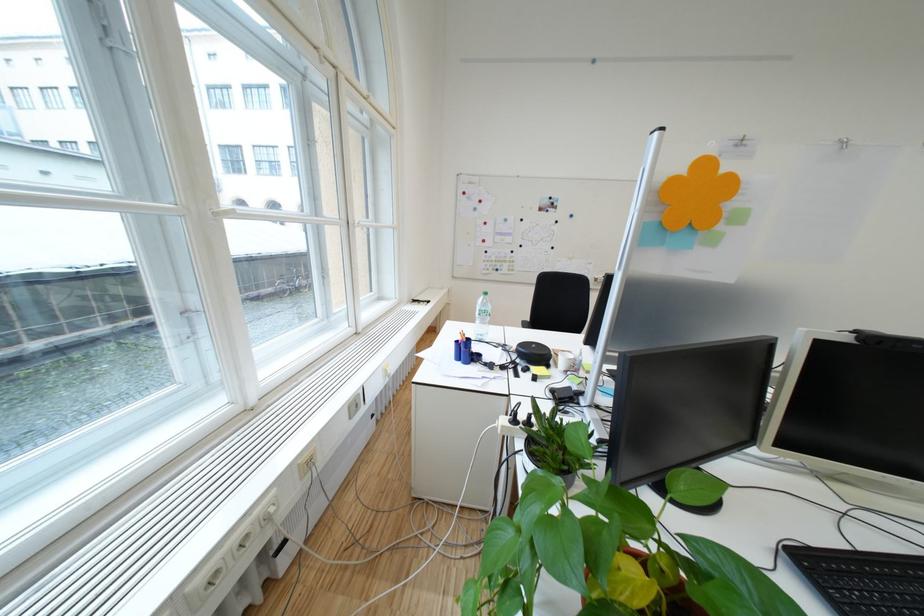
Where would you pull the white window handle? Please return your answer as a coordinate pair (x, y).

(295, 217)